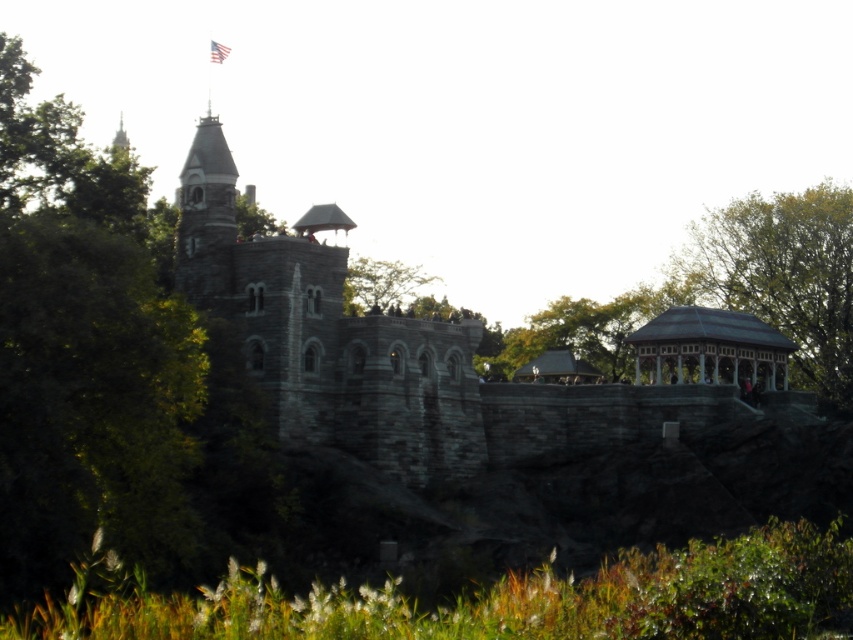
You are standing in front of the historic stone structure and notice two green leafy trees in the scene. Which tree, the green leafy tree at left or the green leafy tree at upper center, is closer to you?

The green leafy tree at left is closer to you because it is positioned over the green leafy tree at upper center, indicating it is in front.

You are standing at the center of the image and want to locate the stone tower at upper left. According to the coordinates provided, in which direction should you look to find it?

The stone tower at upper left is located at coordinates point [206,216], which means you should look to the upper left direction to find it.

You are standing at the base of the historic stone structure and notice a point marked at coordinates (86, 353). Based on the scene described, what object does this point most likely represent?

The point at coordinates (86, 353) corresponds to the green leafy tree at left.